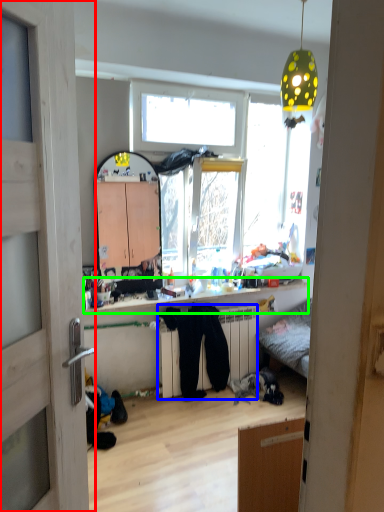
Question: Which object is positioned closest to door (highlighted by a red box)? Select from radiator (highlighted by a blue box) and counter top (highlighted by a green box).

Choices:
 (A) radiator
 (B) counter top

Answer: (B)